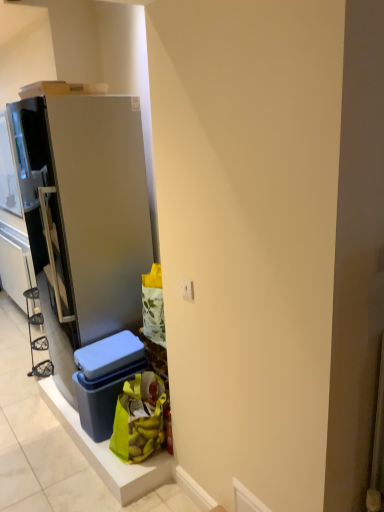
Question: Is satin silver refrigerator at left not close to matte blue plastic storage box at lower center?

Choices:
 (A) yes
 (B) no

Answer: (B)

Question: Considering the relative sizes of satin silver refrigerator at left and matte blue plastic storage box at lower center in the image provided, is satin silver refrigerator at left thinner than matte blue plastic storage box at lower center?

Choices:
 (A) no
 (B) yes

Answer: (A)

Question: Is matte blue plastic storage box at lower center inside satin silver refrigerator at left?

Choices:
 (A) no
 (B) yes

Answer: (A)

Question: Is satin silver refrigerator at left completely or partially outside of matte blue plastic storage box at lower center?

Choices:
 (A) no
 (B) yes

Answer: (B)

Question: From the image's perspective, is satin silver refrigerator at left below matte blue plastic storage box at lower center?

Choices:
 (A) yes
 (B) no

Answer: (B)

Question: Is white plastic electric outlet at center in front of or behind satin silver refrigerator at left in the image?

Choices:
 (A) behind
 (B) front

Answer: (B)

Question: Do you think white plastic electric outlet at center is within satin silver refrigerator at left, or outside of it?

Choices:
 (A) inside
 (B) outside

Answer: (B)

Question: From a real-world perspective, relative to satin silver refrigerator at left, is white plastic electric outlet at center vertically above or below?

Choices:
 (A) below
 (B) above

Answer: (B)

Question: From the image's perspective, is white plastic electric outlet at center positioned above or below satin silver refrigerator at left?

Choices:
 (A) above
 (B) below

Answer: (B)

Question: Based on their positions, is green fabric bag at lower center located to the left or right of white plastic electric outlet at center?

Choices:
 (A) left
 (B) right

Answer: (A)

Question: Looking at their shapes, would you say green fabric bag at lower center is wider or thinner than white plastic electric outlet at center?

Choices:
 (A) thin
 (B) wide

Answer: (B)

Question: In the image, is green fabric bag at lower center positioned in front of or behind white plastic electric outlet at center?

Choices:
 (A) behind
 (B) front

Answer: (A)

Question: From the image's perspective, is green fabric bag at lower center positioned above or below white plastic electric outlet at center?

Choices:
 (A) below
 (B) above

Answer: (A)

Question: From the image's perspective, is green fabric bag at lower center above or below matte blue plastic storage box at lower center?

Choices:
 (A) below
 (B) above

Answer: (A)

Question: From a real-world perspective, is green fabric bag at lower center physically located above or below matte blue plastic storage box at lower center?

Choices:
 (A) below
 (B) above

Answer: (A)